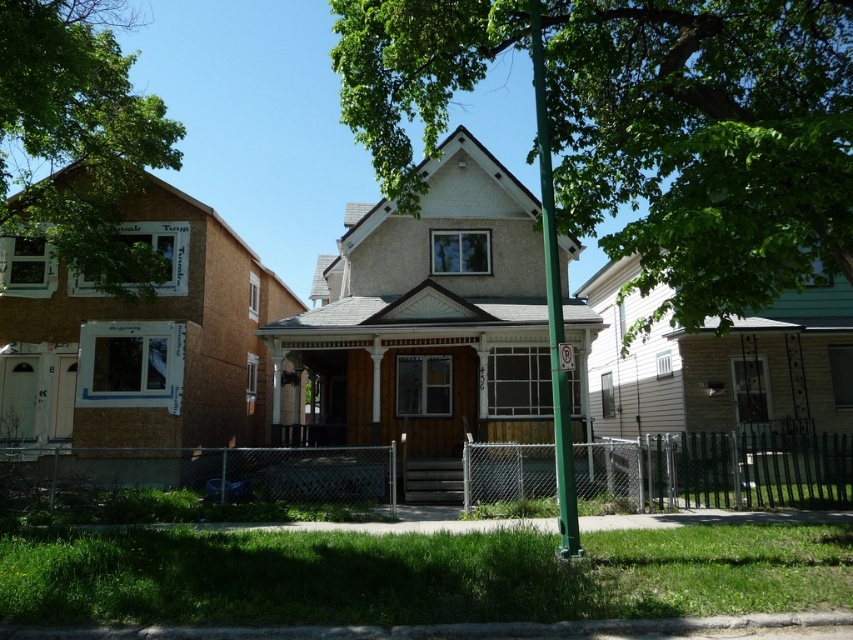
Locate an element on the screen. The width and height of the screenshot is (853, 640). green leafy tree at center is located at coordinates (642, 125).

Between green leafy tree at center and metallic reflective no parking sign at center, which one appears on the left side from the viewer's perspective?

Positioned to the left is metallic reflective no parking sign at center.

You are a GUI agent. You are given a task and a screenshot of the screen. Output one action in this format:
    pyautogui.click(x=<x>, y=<y>)
    Task: Click on the green leafy tree at center
    The height and width of the screenshot is (640, 853).
    Given the screenshot: What is the action you would take?
    pyautogui.click(x=642, y=125)

Who is more forward, (555, 342) or (561, 369)?

Point (561, 369) is more forward.

Is green metallic pole at center above metallic reflective no parking sign at center?

No.

Find the location of a particular element. The height and width of the screenshot is (640, 853). green metallic pole at center is located at coordinates (554, 310).

The height and width of the screenshot is (640, 853). What are the coordinates of `green metallic pole at center` in the screenshot? It's located at (554, 310).

Locate an element on the screen. green leafy tree at center is located at coordinates (642, 125).

Which is behind, point (434, 29) or point (4, 138)?

Positioned behind is point (4, 138).

You are a GUI agent. You are given a task and a screenshot of the screen. Output one action in this format:
    pyautogui.click(x=<x>, y=<y>)
    Task: Click on the green leafy tree at center
    The width and height of the screenshot is (853, 640).
    Given the screenshot: What is the action you would take?
    pyautogui.click(x=642, y=125)